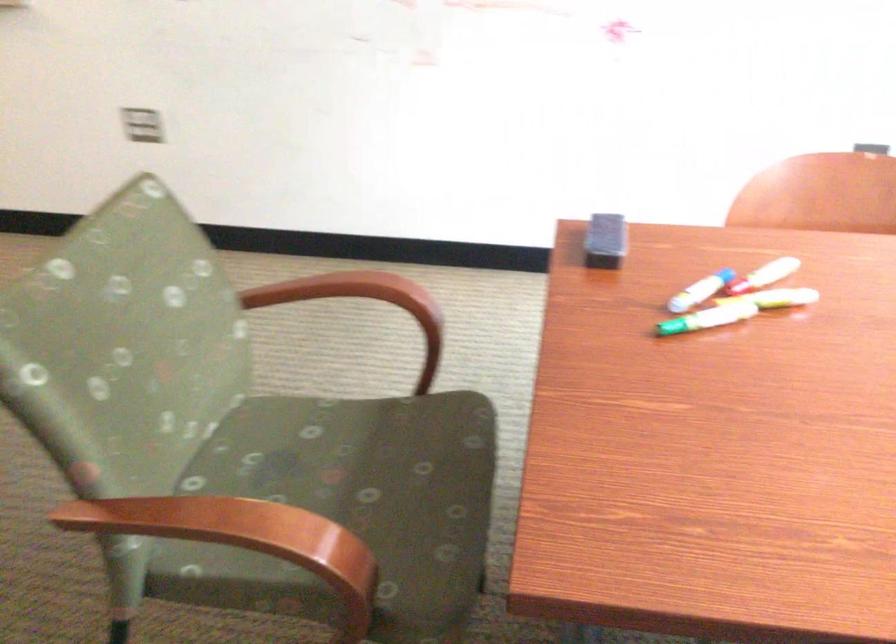
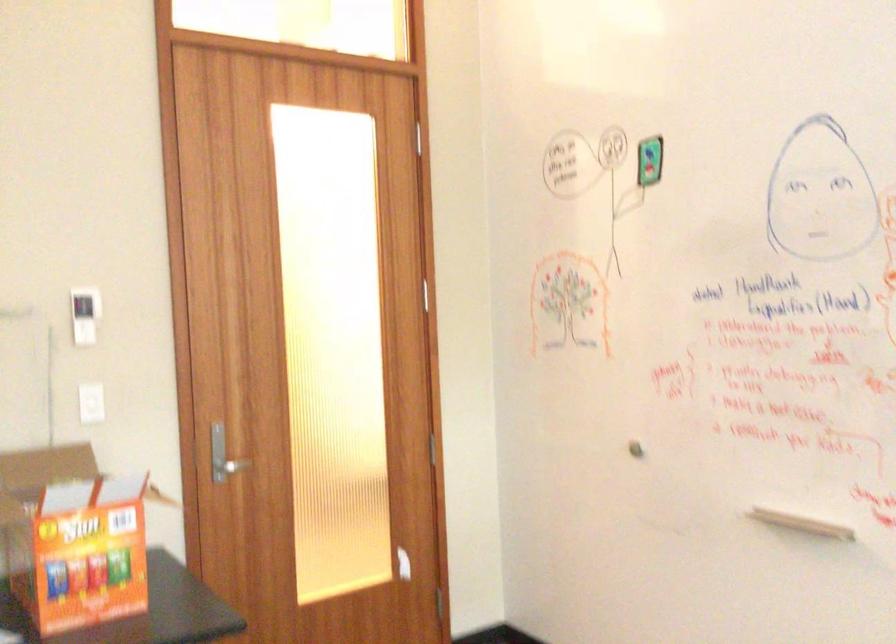
Based on the continuous images, in which direction is the camera rotating?

The camera rotated toward left-up.